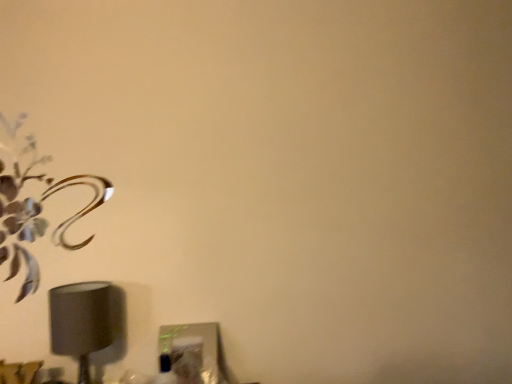
What do you see at coordinates (37, 214) in the screenshot? The width and height of the screenshot is (512, 384). I see `metallic silver flower at upper left` at bounding box center [37, 214].

Measure the distance between metallic silver flower at upper left and camera.

The depth of metallic silver flower at upper left is 1.19 meters.

Where is `metallic silver flower at upper left`? Image resolution: width=512 pixels, height=384 pixels. metallic silver flower at upper left is located at coordinates (37, 214).

Describe the element at coordinates (80, 322) in the screenshot. The height and width of the screenshot is (384, 512). I see `matte gray lampshade at lower left` at that location.

This screenshot has height=384, width=512. I want to click on matte gray lampshade at lower left, so click(80, 322).

Find the location of a particular element. metallic silver flower at upper left is located at coordinates (x=37, y=214).

Which is more to the left, matte gray lampshade at lower left or metallic silver flower at upper left?

metallic silver flower at upper left is more to the left.

Which object is closer to the camera, matte gray lampshade at lower left or metallic silver flower at upper left?

matte gray lampshade at lower left is in front.

Is point (64, 301) farther from viewer compared to point (12, 268)?

No.

From the image's perspective, which one is positioned lower, matte gray lampshade at lower left or metallic silver flower at upper left?

matte gray lampshade at lower left.

From a real-world perspective, which is physically above, matte gray lampshade at lower left or metallic silver flower at upper left?

From a 3D spatial view, metallic silver flower at upper left is above.

Which of these two, matte gray lampshade at lower left or metallic silver flower at upper left, is wider?

matte gray lampshade at lower left is wider.

Can you confirm if matte gray lampshade at lower left is shorter than metallic silver flower at upper left?

Indeed, matte gray lampshade at lower left has a lesser height compared to metallic silver flower at upper left.

In the scene shown: Who is bigger, matte gray lampshade at lower left or metallic silver flower at upper left?

Result: matte gray lampshade at lower left is bigger.

Is matte gray lampshade at lower left inside or outside of metallic silver flower at upper left?

matte gray lampshade at lower left is spatially situated outside metallic silver flower at upper left.

Are matte gray lampshade at lower left and metallic silver flower at upper left beside each other?

No, matte gray lampshade at lower left is not in contact with metallic silver flower at upper left.

Does matte gray lampshade at lower left turn towards metallic silver flower at upper left?

No, matte gray lampshade at lower left is not facing towards metallic silver flower at upper left.

How many degrees apart are the facing directions of matte gray lampshade at lower left and metallic silver flower at upper left?

The facing directions of matte gray lampshade at lower left and metallic silver flower at upper left are 0.000888 degrees apart.

Measure the distance between matte gray lampshade at lower left and metallic silver flower at upper left.

matte gray lampshade at lower left and metallic silver flower at upper left are 10.69 inches apart from each other.

At what (x,y) coordinates should I click in order to perform the action: click on lamp that appears below the metallic silver flower at upper left (from a real-world perspective). Please return your answer as a coordinate pair (x, y). The image size is (512, 384). Looking at the image, I should click on (80, 322).

Which object is positioned more to the left, metallic silver flower at upper left or matte gray lampshade at lower left?

metallic silver flower at upper left is more to the left.

Does metallic silver flower at upper left come behind matte gray lampshade at lower left?

Yes, the depth of metallic silver flower at upper left is greater than that of matte gray lampshade at lower left.

Is point (9, 127) closer to camera compared to point (101, 298)?

No.

From the image's perspective, which one is positioned higher, metallic silver flower at upper left or matte gray lampshade at lower left?

metallic silver flower at upper left appears higher in the image.

From a real-world perspective, who is located higher, metallic silver flower at upper left or matte gray lampshade at lower left?

metallic silver flower at upper left is physically above.

Does metallic silver flower at upper left have a greater width compared to matte gray lampshade at lower left?

No.

Which of these two, metallic silver flower at upper left or matte gray lampshade at lower left, stands shorter?

matte gray lampshade at lower left is shorter.

Is metallic silver flower at upper left smaller than matte gray lampshade at lower left?

Yes.

Can matte gray lampshade at lower left be found inside metallic silver flower at upper left?

No, matte gray lampshade at lower left is not surrounded by metallic silver flower at upper left.

Is metallic silver flower at upper left far from matte gray lampshade at lower left?

No.

Is metallic silver flower at upper left looking in the opposite direction of matte gray lampshade at lower left?

No.

How many degrees apart are the facing directions of metallic silver flower at upper left and matte gray lampshade at lower left?

The angular difference between metallic silver flower at upper left and matte gray lampshade at lower left is 0.000888 degrees.

Image resolution: width=512 pixels, height=384 pixels. In order to click on lamp in front of the metallic silver flower at upper left in this screenshot , I will do `click(80, 322)`.

In the image, there is a metallic silver flower at upper left. At what (x,y) coordinates should I click in order to perform the action: click on lamp below it (from the image's perspective). Please return your answer as a coordinate pair (x, y). Image resolution: width=512 pixels, height=384 pixels. Looking at the image, I should click on (80, 322).

This screenshot has width=512, height=384. Identify the location of flower behind the matte gray lampshade at lower left. (37, 214).